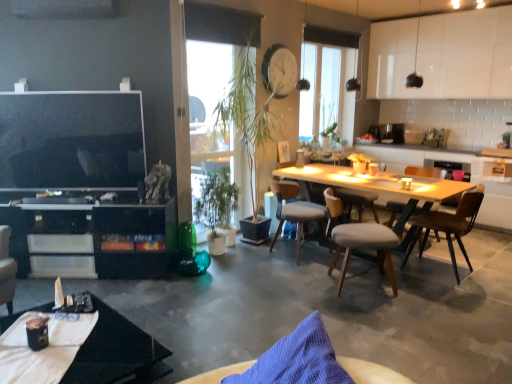
Question: In terms of width, does brown wooden chair at center, the fourth chair viewed from the left, look wider or thinner when compared to black glossy cabinet at lower left?

Choices:
 (A) thin
 (B) wide

Answer: (B)

Question: Is brown wooden chair at center, the 2th chair positioned from the back, taller or shorter than black glossy cabinet at lower left?

Choices:
 (A) tall
 (B) short

Answer: (A)

Question: Which object is the closest to the black glossy cabinet at lower left?

Choices:
 (A) light gray fabric chair at center, acting as the 2th chair starting from the left
 (B) blue fabric chair at lower center, the 4th chair viewed from the back
 (C) brown wooden chair at center, the fourth chair viewed from the left
 (D) green leafy plant at center
 (E) transparent glass window at center

Answer: (D)

Question: Which of these objects is positioned closest to the black glossy cabinet at lower left?

Choices:
 (A) black glossy coffee machine at upper center
 (B) concreteroughfloor at lower center
 (C) light gray fabric chair at center, acting as the 2th chair starting from the left
 (D) transparent glass window at center
 (E) blue fabric chair at lower center, positioned as the first chair in left-to-right order

Answer: (B)